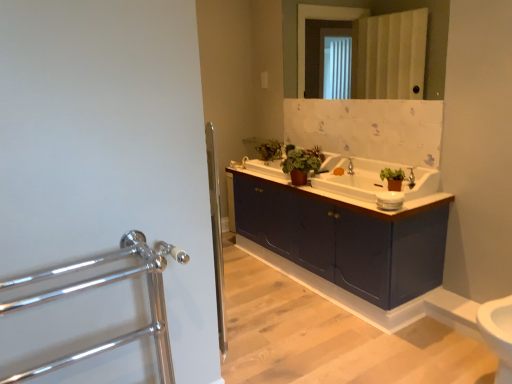
Question: Is green matte plant at center, acting as the 2th plant starting from the left, positioned in front of green matte plant at upper center, marked as the second plant in a right-to-left arrangement?

Choices:
 (A) no
 (B) yes

Answer: (B)

Question: From a real-world perspective, does green matte plant at center, marked as the first plant in a front-to-back arrangement, stand above green matte plant at upper center, which ranks as the 1th plant in left-to-right order?

Choices:
 (A) no
 (B) yes

Answer: (A)

Question: Is green matte plant at center, placed as the first plant when sorted from right to left, taller than green matte plant at upper center, which ranks as the 1th plant in left-to-right order?

Choices:
 (A) yes
 (B) no

Answer: (B)

Question: Is green matte plant at center, the second plant viewed from the back, bigger than green matte plant at upper center, the second plant viewed from the front?

Choices:
 (A) yes
 (B) no

Answer: (B)

Question: Can you confirm if green matte plant at center, acting as the 2th plant starting from the left, is positioned to the right of green matte plant at upper center, arranged as the first plant when viewed from the back?

Choices:
 (A) no
 (B) yes

Answer: (B)

Question: Is green matte plant at center, placed as the first plant when sorted from right to left, oriented towards green matte plant at upper center, the second plant viewed from the front?

Choices:
 (A) yes
 (B) no

Answer: (B)

Question: From the image's perspective, would you say white glossy sink at center is positioned over matte white mirror at upper center?

Choices:
 (A) no
 (B) yes

Answer: (A)

Question: Considering the relative sizes of white glossy sink at center and matte white mirror at upper center in the image provided, is white glossy sink at center thinner than matte white mirror at upper center?

Choices:
 (A) yes
 (B) no

Answer: (B)

Question: Is white glossy sink at center at the left side of matte white mirror at upper center?

Choices:
 (A) no
 (B) yes

Answer: (A)

Question: Is white glossy sink at center at the right side of matte white mirror at upper center?

Choices:
 (A) yes
 (B) no

Answer: (A)

Question: Considering the relative sizes of white glossy sink at center and matte white mirror at upper center in the image provided, is white glossy sink at center taller than matte white mirror at upper center?

Choices:
 (A) yes
 (B) no

Answer: (B)

Question: Is white glossy sink at center outside matte white mirror at upper center?

Choices:
 (A) no
 (B) yes

Answer: (B)

Question: Is polished chrome towel rack at left oriented away from matte blue cabinet at center?

Choices:
 (A) no
 (B) yes

Answer: (A)